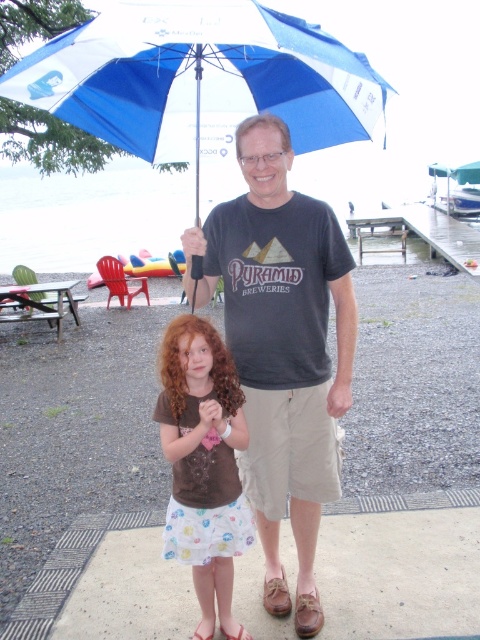
Who is lower down, concrete pavement at lower center or wooden picnic table at left?

concrete pavement at lower center is below.

What do you see at coordinates (68, 570) in the screenshot? The height and width of the screenshot is (640, 480). I see `concrete pavement at lower center` at bounding box center [68, 570].

Find the location of a particular element. concrete pavement at lower center is located at coordinates (68, 570).

Is point (319, 72) less distant than point (351, 513)?

That is True.

Does blue/white striped umbrella at upper center appear on the right side of concrete pavement at lower center?

Yes, blue/white striped umbrella at upper center is to the right of concrete pavement at lower center.

This screenshot has width=480, height=640. Describe the element at coordinates (201, 80) in the screenshot. I see `blue/white striped umbrella at upper center` at that location.

Where is `blue/white striped umbrella at upper center`? Image resolution: width=480 pixels, height=640 pixels. blue/white striped umbrella at upper center is located at coordinates (201, 80).

Looking at this image, who is more distant from viewer, (164, 35) or (24, 285)?

The point (24, 285) is more distant.

Describe the element at coordinates (201, 80) in the screenshot. The width and height of the screenshot is (480, 640). I see `blue/white striped umbrella at upper center` at that location.

Which is in front, point (243, 108) or point (76, 280)?

Point (243, 108) is in front.

Find the location of a particular element. The height and width of the screenshot is (640, 480). blue/white striped umbrella at upper center is located at coordinates (201, 80).